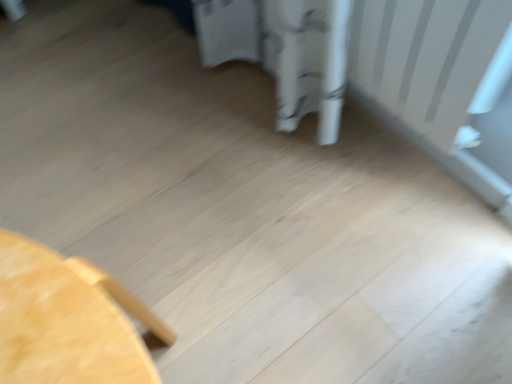
Question: Is white matte radiator at upper right positioned in front of light wood table at lower left?

Choices:
 (A) no
 (B) yes

Answer: (A)

Question: Considering the relative positions of white matte radiator at upper right and light wood table at lower left in the image provided, is white matte radiator at upper right behind light wood table at lower left?

Choices:
 (A) yes
 (B) no

Answer: (A)

Question: Is white matte radiator at upper right located outside light wood table at lower left?

Choices:
 (A) no
 (B) yes

Answer: (B)

Question: Can you confirm if white matte radiator at upper right is smaller than light wood table at lower left?

Choices:
 (A) no
 (B) yes

Answer: (B)

Question: From the image's perspective, is white matte radiator at upper right located above light wood table at lower left?

Choices:
 (A) yes
 (B) no

Answer: (A)

Question: Does white matte radiator at upper right have a greater width compared to light wood table at lower left?

Choices:
 (A) no
 (B) yes

Answer: (A)

Question: Is light wood table at lower left bigger than white matte radiator at upper right?

Choices:
 (A) yes
 (B) no

Answer: (A)

Question: Can we say light wood table at lower left lies outside white matte radiator at upper right?

Choices:
 (A) no
 (B) yes

Answer: (B)

Question: Is light wood table at lower left next to white matte radiator at upper right?

Choices:
 (A) no
 (B) yes

Answer: (A)

Question: From a real-world perspective, is light wood table at lower left below white matte radiator at upper right?

Choices:
 (A) no
 (B) yes

Answer: (B)

Question: Does light wood table at lower left come in front of white matte radiator at upper right?

Choices:
 (A) yes
 (B) no

Answer: (A)

Question: Considering the relative sizes of light wood table at lower left and white matte radiator at upper right in the image provided, is light wood table at lower left shorter than white matte radiator at upper right?

Choices:
 (A) yes
 (B) no

Answer: (B)

Question: Based on their positions, is light wood table at lower left located to the left or right of white matte radiator at upper right?

Choices:
 (A) left
 (B) right

Answer: (A)